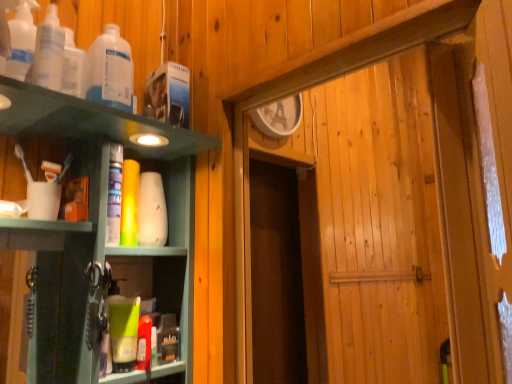
Question: Based on their positions, is green matte tube at lower left, positioned as the second toiletry in back-to-front order, located to the left or right of translucent plastic bottles at upper left, placed as the first bottle when sorted from front to back?

Choices:
 (A) left
 (B) right

Answer: (B)

Question: From a real-world perspective, is green matte tube at lower left, the first toiletry viewed from the front, above or below translucent plastic bottles at upper left, which is the 3th bottle from back to front?

Choices:
 (A) below
 (B) above

Answer: (A)

Question: Which is farther from the white matte cup at left?

Choices:
 (A) translucent plastic bottles at upper left, which is the second bottle in front-to-back order
 (B) green matte tube at lower left, marked as the second toiletry in a top-to-bottom arrangement
 (C) translucent plastic bottles at upper left, which is the 3th bottle from back to front
 (D) white matte vase at center, positioned as the second toiletry in front-to-back order
 (E) translucent plastic bottle at upper left, arranged as the 3th bottle when viewed from the front

Answer: (B)

Question: Estimate the real-world distances between objects in this image. Which object is farther from the white matte vase at center, the 2th toiletry ordered from the bottom?

Choices:
 (A) translucent plastic bottle at upper left, the 1th bottle positioned from the back
 (B) white matte cup at left
 (C) green matte tube at lower left, the 1th toiletry from the bottom
 (D) translucent plastic bottles at upper left, which is the second bottle in front-to-back order
 (E) translucent plastic bottles at upper left, which is the 3th bottle from back to front

Answer: (E)